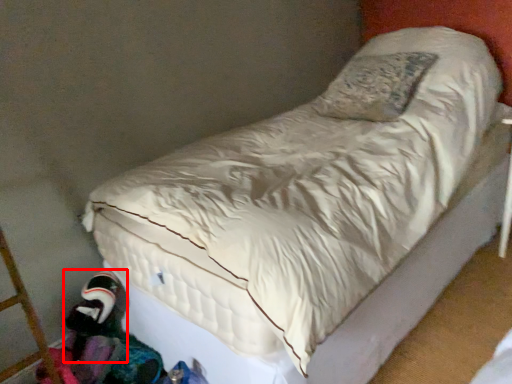
Question: From the image's perspective, what is the correct spatial relationship of toy (annotated by the red box) in relation to clothing?

Choices:
 (A) above
 (B) below

Answer: (A)